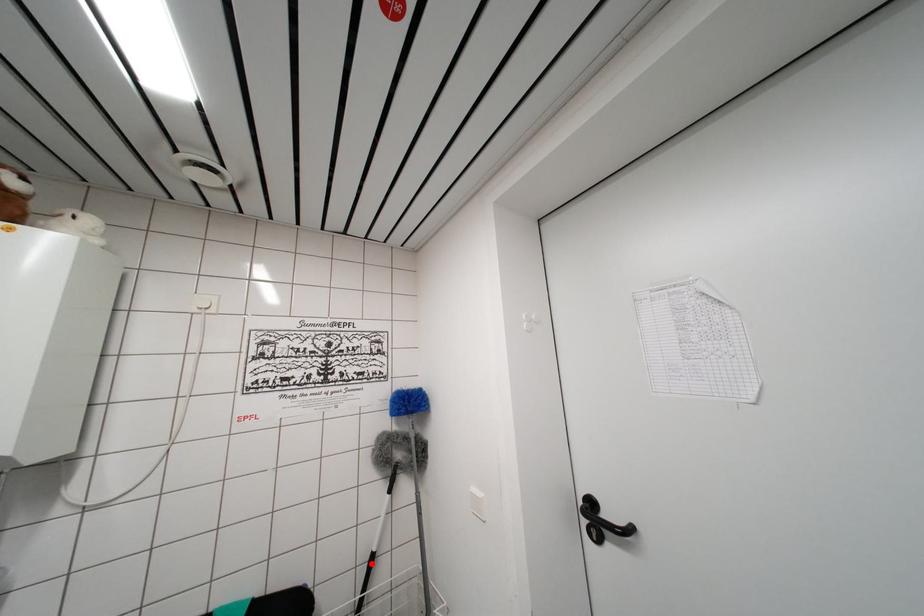
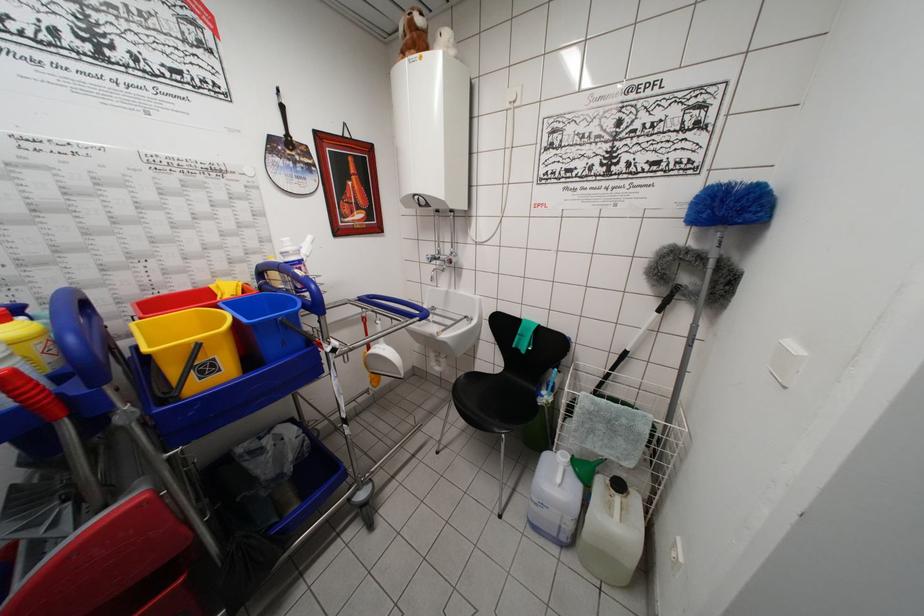
Find the pixel in the second image that matches the highlighted location in the first image.

(624, 358)